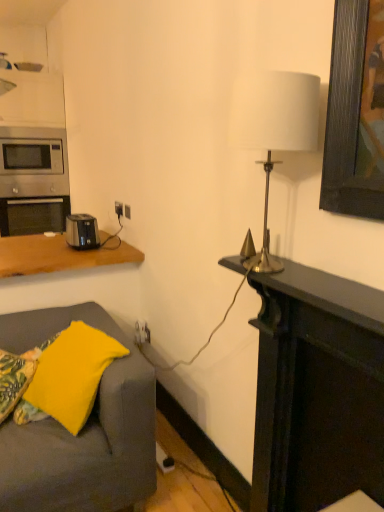
Question: Is stainless steel oven at left shorter than dark wood fireplace at right?

Choices:
 (A) yes
 (B) no

Answer: (A)

Question: Does stainless steel oven at left come in front of dark wood fireplace at right?

Choices:
 (A) yes
 (B) no

Answer: (B)

Question: Is stainless steel oven at left taller than dark wood fireplace at right?

Choices:
 (A) no
 (B) yes

Answer: (A)

Question: Is stainless steel oven at left positioned beyond the bounds of dark wood fireplace at right?

Choices:
 (A) no
 (B) yes

Answer: (B)

Question: Is dark wood fireplace at right at the back of stainless steel oven at left?

Choices:
 (A) yes
 (B) no

Answer: (B)

Question: From a real-world perspective, is black plastic toaster at left physically located above or below white fabric lampshade at upper right?

Choices:
 (A) below
 (B) above

Answer: (A)

Question: Based on their positions, is black plastic toaster at left located to the left or right of white fabric lampshade at upper right?

Choices:
 (A) left
 (B) right

Answer: (A)

Question: Is black plastic toaster at left in front of or behind white fabric lampshade at upper right in the image?

Choices:
 (A) front
 (B) behind

Answer: (B)

Question: Considering the positions of black plastic toaster at left and white fabric lampshade at upper right in the image, is black plastic toaster at left taller or shorter than white fabric lampshade at upper right?

Choices:
 (A) short
 (B) tall

Answer: (A)

Question: From a real-world perspective, relative to stainless steel oven at left, is yellow fabric pillow at lower left, the 1th pillow when ordered from right to left, vertically above or below?

Choices:
 (A) above
 (B) below

Answer: (B)

Question: Does point (81, 362) appear closer or farther from the camera than point (13, 233)?

Choices:
 (A) closer
 (B) farther

Answer: (A)

Question: Looking at their shapes, would you say yellow fabric pillow at lower left, the 1th pillow when ordered from right to left, is wider or thinner than stainless steel oven at left?

Choices:
 (A) thin
 (B) wide

Answer: (A)

Question: In the image, is yellow fabric pillow at lower left, the 1th pillow when ordered from right to left, on the left side or the right side of stainless steel oven at left?

Choices:
 (A) left
 (B) right

Answer: (B)

Question: From the image's perspective, is black plastic toaster at left positioned above or below stainless steel oven at left?

Choices:
 (A) below
 (B) above

Answer: (A)

Question: From a real-world perspective, is black plastic toaster at left positioned above or below stainless steel oven at left?

Choices:
 (A) below
 (B) above

Answer: (B)